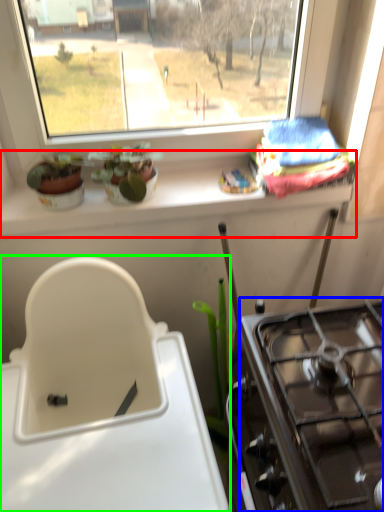
Question: Which object is the farthest from window sill (highlighted by a red box)? Choose among these: gas stove (highlighted by a blue box) or sink (highlighted by a green box).

Choices:
 (A) gas stove
 (B) sink

Answer: (A)